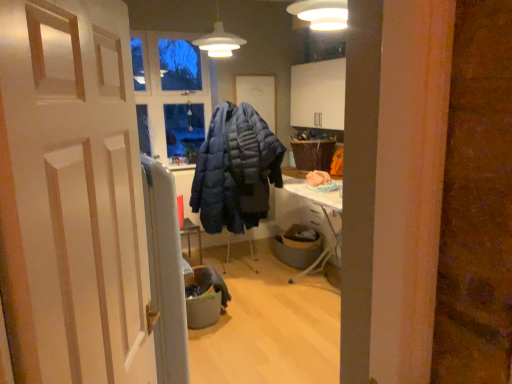
Question: Does gray fabric trash bin at center, which is the first trash bin/can in front-to-back order, have a greater height compared to white wooden door at center?

Choices:
 (A) no
 (B) yes

Answer: (A)

Question: Is gray fabric trash bin at center, which is the first trash bin/can in front-to-back order, behind white wooden door at center?

Choices:
 (A) yes
 (B) no

Answer: (A)

Question: Is gray fabric trash bin at center, placed as the 2th trash bin/can when sorted from right to left, touching white wooden door at center?

Choices:
 (A) no
 (B) yes

Answer: (A)

Question: Is gray fabric trash bin at center, arranged as the 2th trash bin/can when viewed from the back, looking in the opposite direction of white wooden door at center?

Choices:
 (A) yes
 (B) no

Answer: (B)

Question: Is gray fabric trash bin at center, arranged as the 2th trash bin/can when viewed from the back, at the right side of white wooden door at center?

Choices:
 (A) no
 (B) yes

Answer: (A)

Question: Relative to woven brown picnic basket at upper right, is gray fabric trash bin at center, which appears as the 1th trash bin/can when viewed from the right, in front or behind?

Choices:
 (A) behind
 (B) front

Answer: (B)

Question: Which is correct: gray fabric trash bin at center, which appears as the 1th trash bin/can when viewed from the right, is inside woven brown picnic basket at upper right, or outside of it?

Choices:
 (A) outside
 (B) inside

Answer: (A)

Question: In terms of height, does gray fabric trash bin at center, placed as the 2th trash bin/can when sorted from left to right, look taller or shorter compared to woven brown picnic basket at upper right?

Choices:
 (A) short
 (B) tall

Answer: (A)

Question: From a real-world perspective, is gray fabric trash bin at center, which is the 1th trash bin/can from back to front, positioned above or below woven brown picnic basket at upper right?

Choices:
 (A) below
 (B) above

Answer: (A)

Question: In terms of width, does woven brown picnic basket at upper right look wider or thinner when compared to white wooden door at center?

Choices:
 (A) thin
 (B) wide

Answer: (B)

Question: From a real-world perspective, relative to white wooden door at center, is woven brown picnic basket at upper right vertically above or below?

Choices:
 (A) above
 (B) below

Answer: (B)

Question: In the image, is woven brown picnic basket at upper right positioned in front of or behind white wooden door at center?

Choices:
 (A) front
 (B) behind

Answer: (B)

Question: Is woven brown picnic basket at upper right taller or shorter than white wooden door at center?

Choices:
 (A) tall
 (B) short

Answer: (B)

Question: Is point (282, 249) positioned closer to the camera than point (44, 34)?

Choices:
 (A) closer
 (B) farther

Answer: (B)

Question: From the image's perspective, is gray fabric trash bin at center, placed as the 2th trash bin/can when sorted from left to right, above or below white wooden door at center?

Choices:
 (A) below
 (B) above

Answer: (A)